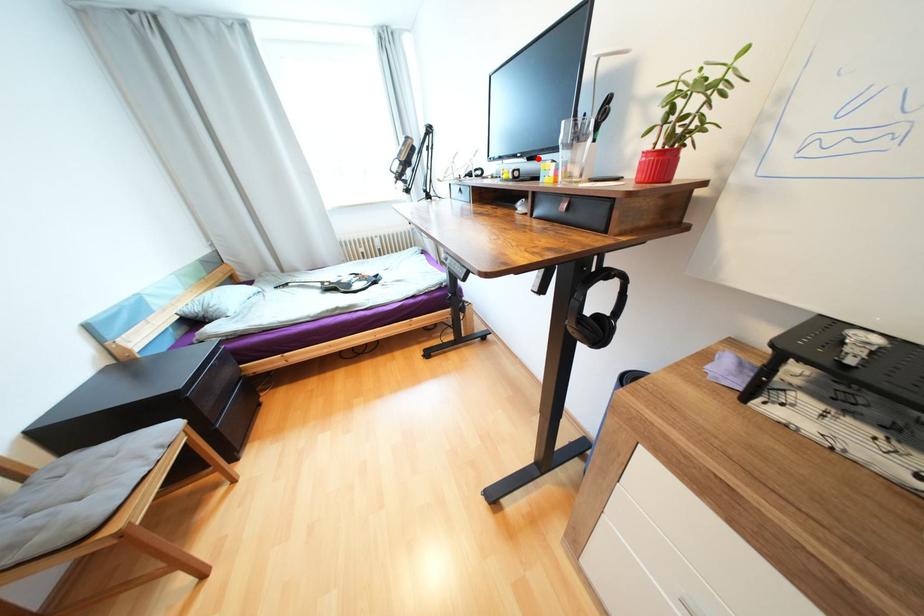
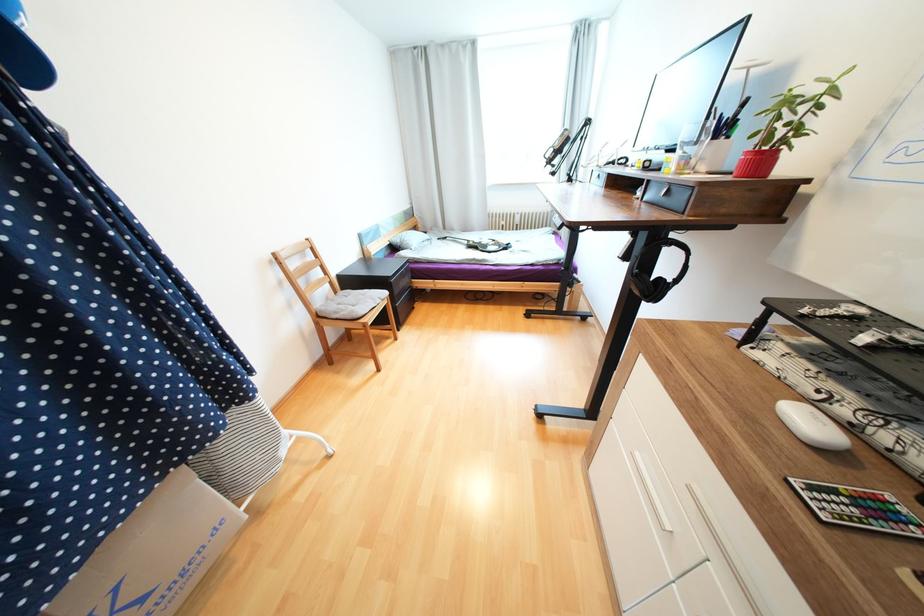
Find the pixel in the second image that matches the highlighted location in the first image.

(676, 151)